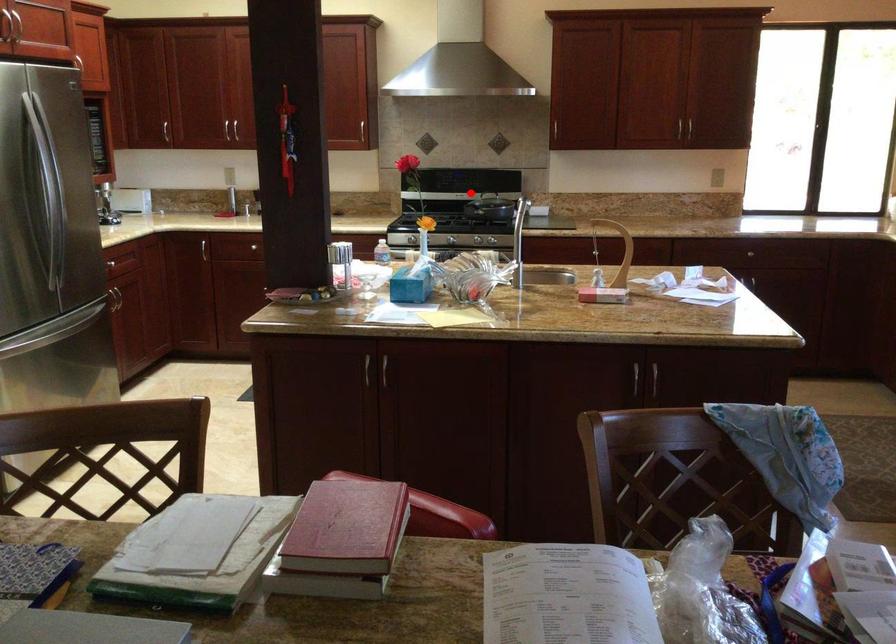
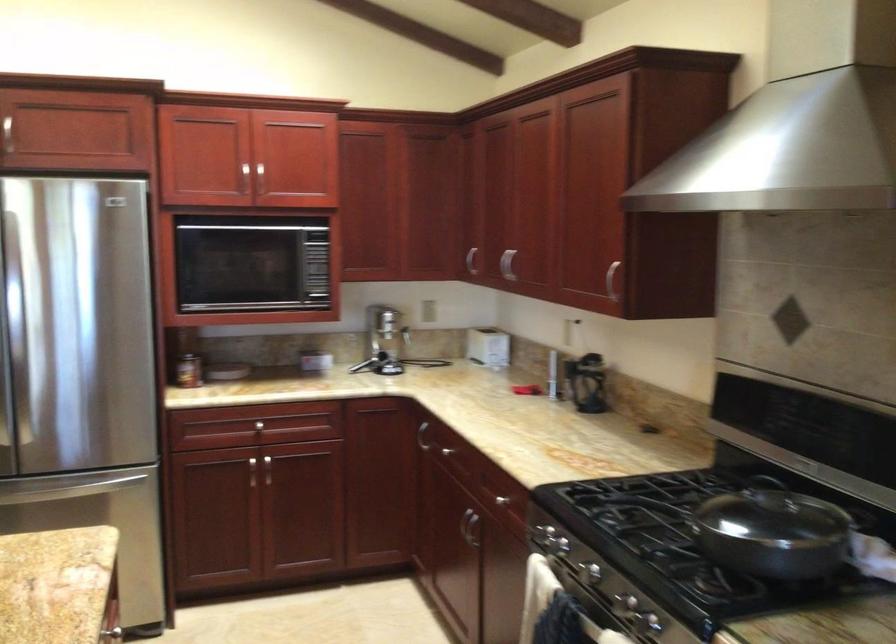
Question: I am providing you with two images of the same scene from different viewpoints. A red point is shown in image1. For the corresponding object point in image2, is it positioned nearer or farther from the camera?

Choices:
 (A) Nearer
 (B) Farther

Answer: (A)